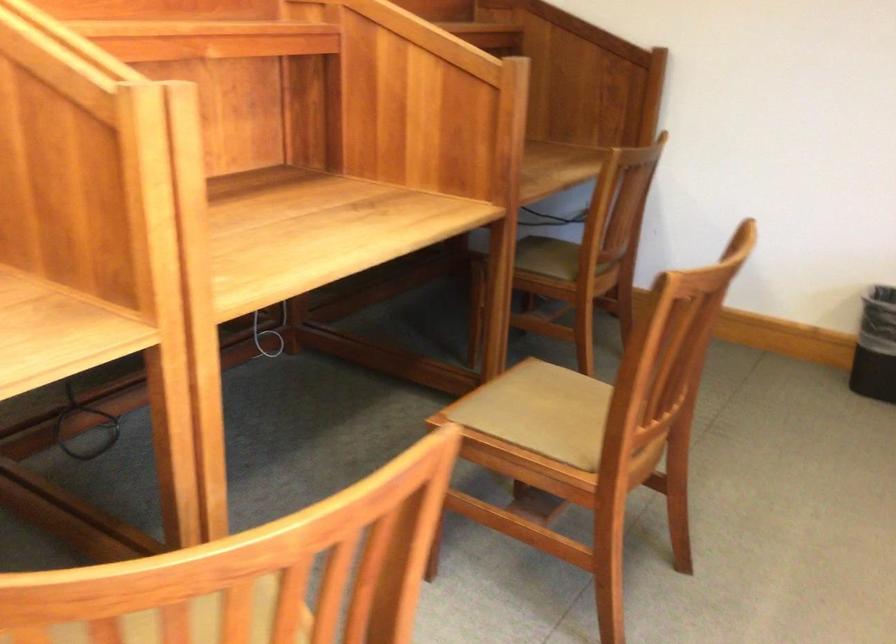
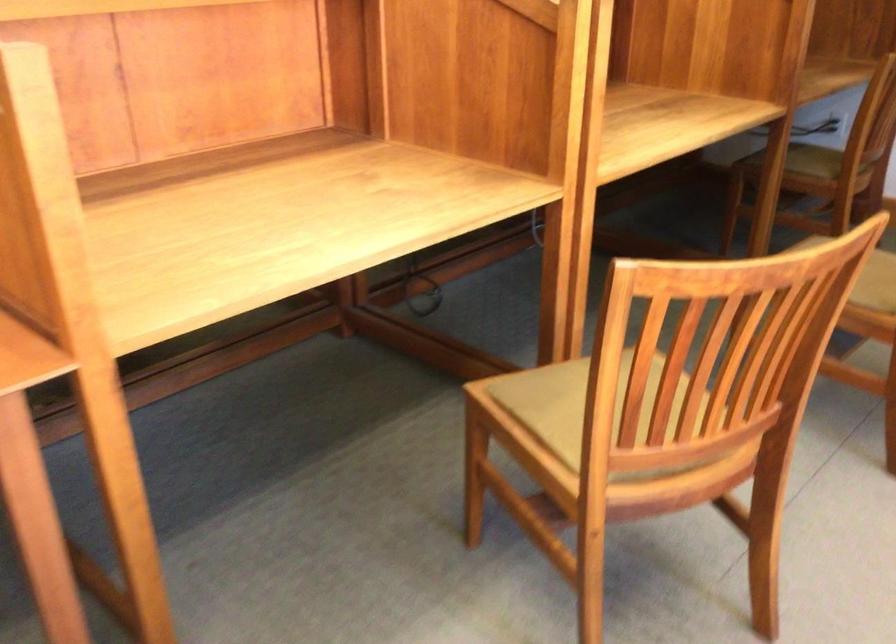
In the second image, find the point that corresponds to point 546,272 in the first image.

(814, 161)